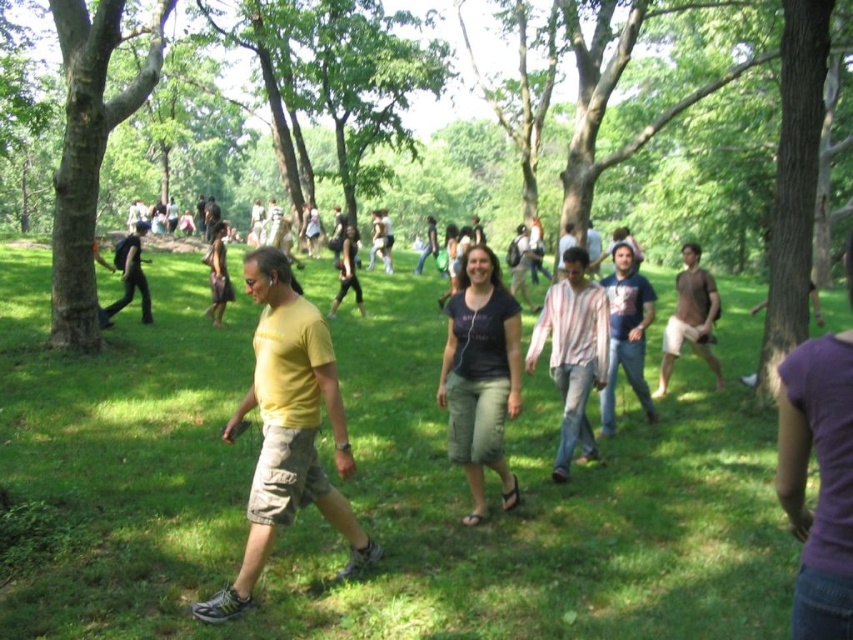
You are a photographer trying to capture a candid shot of two people walking in the park. You see a striped cotton shirt at center and a matte black shirt at center. Which shirt is more to the right?

The striped cotton shirt at center is more to the right because it is positioned on the right side of the matte black shirt at center.